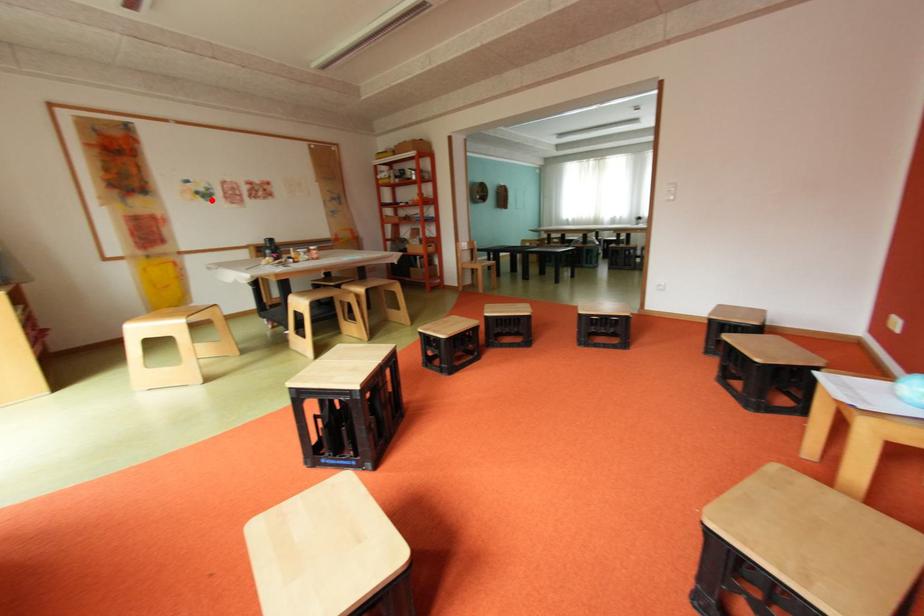
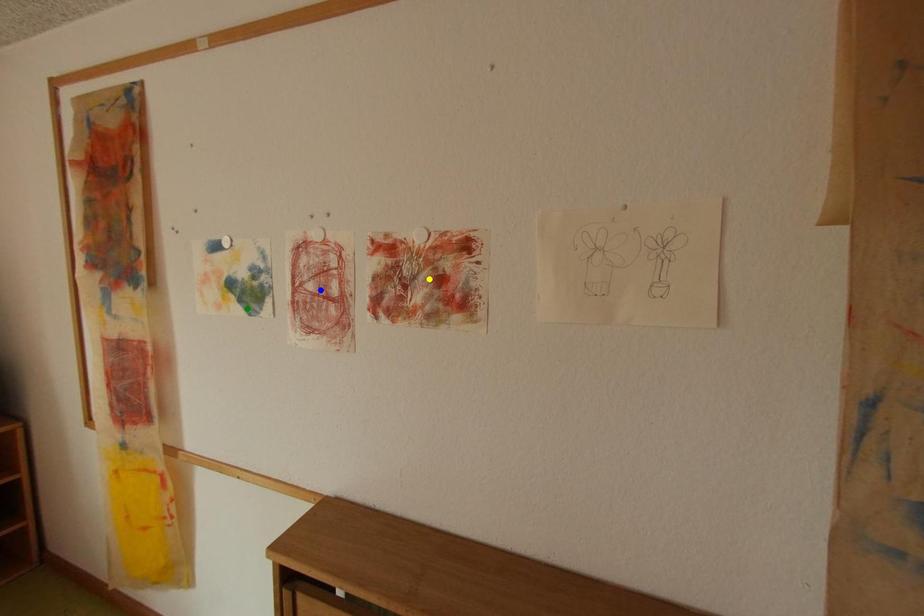
Question: I am providing you with two images of the same scene from different viewpoints. A red point is marked on the first image. You are given multiple points on the second image. In image 2, which mark is for the same physical point as the one in image 1?

Choices:
 (A) yellow point
 (B) green point
 (C) blue point

Answer: (B)